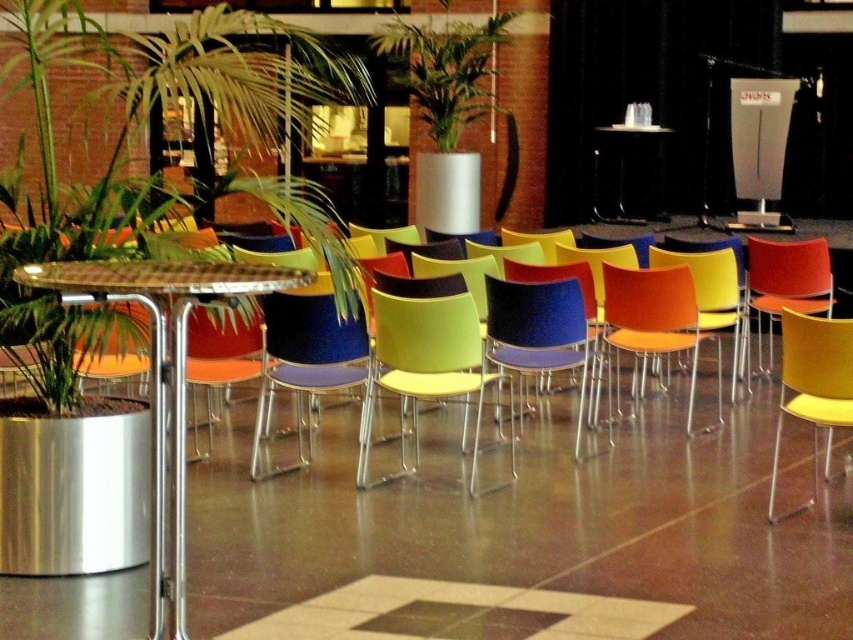
Is matte yellow swivel chair at center to the left of orange plastic swivel chair at center from the viewer's perspective?

Correct, you'll find matte yellow swivel chair at center to the left of orange plastic swivel chair at center.

Can you confirm if matte yellow swivel chair at center is wider than orange plastic swivel chair at center?

No.

Who is more distant from viewer, [438,321] or [624,273]?

The point [624,273] is behind.

The width and height of the screenshot is (853, 640). In order to click on matte yellow swivel chair at center in this screenshot , I will do `click(422, 365)`.

What do you see at coordinates (538, 332) in the screenshot? I see `blue glossy chair at center` at bounding box center [538, 332].

Does point (548, 365) lie behind point (660, 305)?

No, (548, 365) is in front of (660, 305).

Which is in front, point (494, 362) or point (676, 305)?

Point (494, 362) is in front.

This screenshot has height=640, width=853. What are the coordinates of `blue glossy chair at center` in the screenshot? It's located at (538, 332).

What do you see at coordinates (538, 332) in the screenshot? The height and width of the screenshot is (640, 853). I see `blue glossy chair at center` at bounding box center [538, 332].

Can you confirm if blue glossy chair at center is thinner than black glossy table at center?

Yes.

Identify the location of blue glossy chair at center. This screenshot has height=640, width=853. point(538,332).

I want to click on blue glossy chair at center, so click(538, 332).